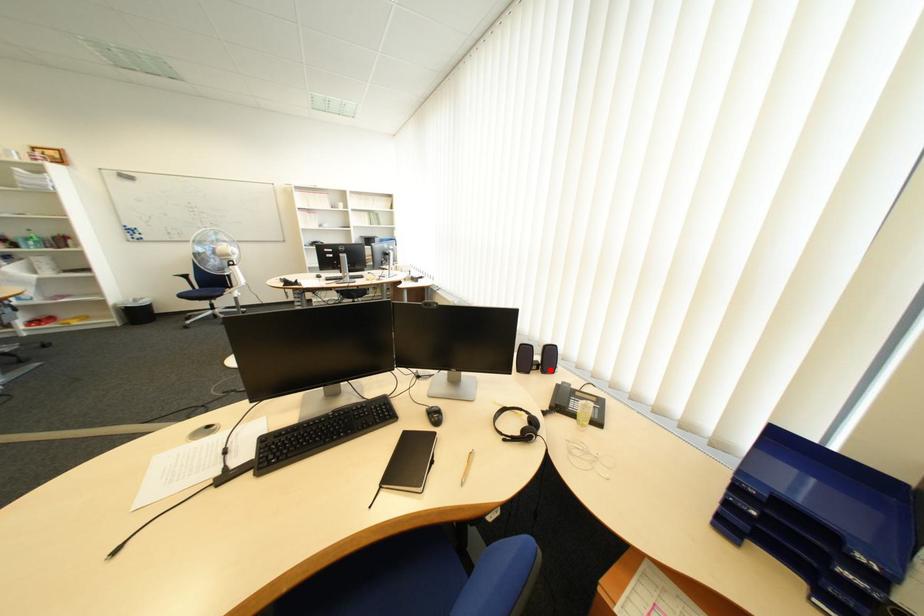
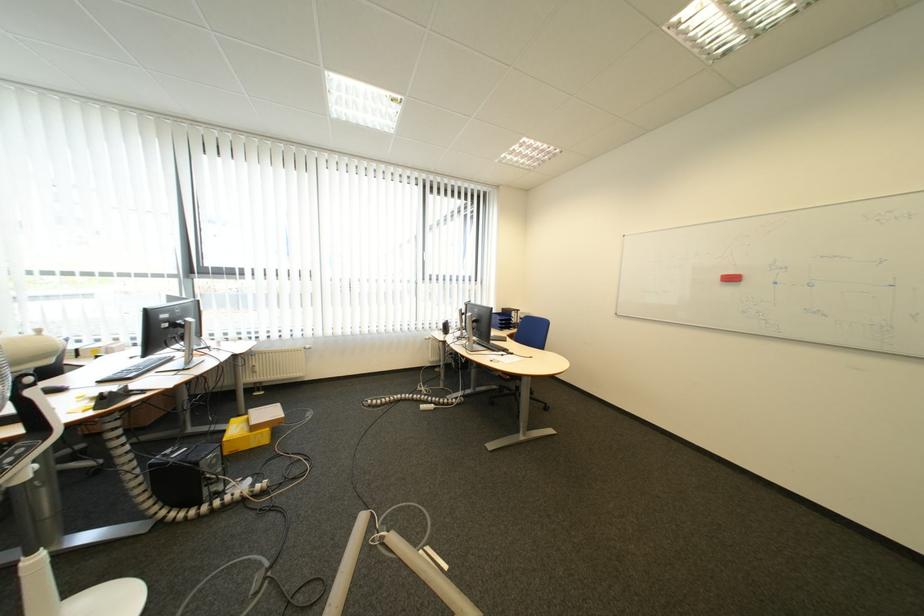
Question: I am providing you with two images of the same scene from different viewpoints. A red point is marked on the first image. Can you still see the location of the red point in image 2?

Choices:
 (A) Yes
 (B) No

Answer: (B)